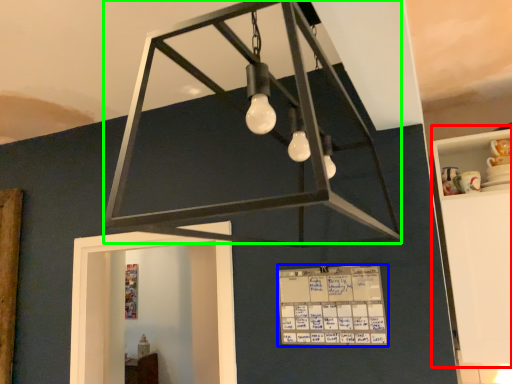
Question: Considering the real-world distances, which object is closest to furniture (highlighted by a red box)? writing (highlighted by a blue box) or lamp (highlighted by a green box).

Choices:
 (A) writing
 (B) lamp

Answer: (A)